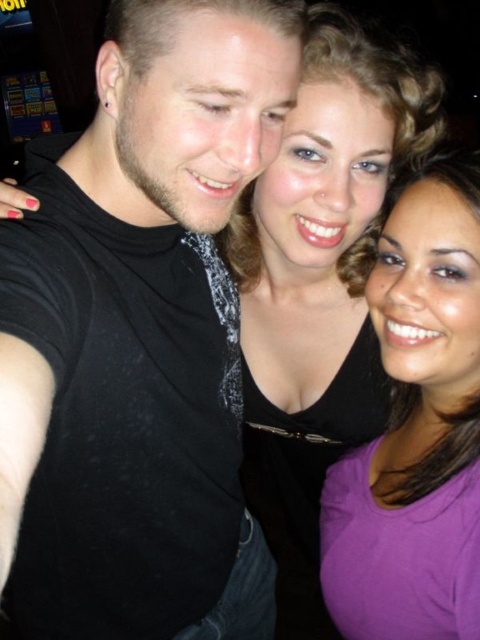
Is point (123, 458) closer to camera compared to point (332, 116)?

Yes, it is.

Between point (76, 472) and point (325, 211), which one is positioned in front?

Point (76, 472)

This screenshot has height=640, width=480. What do you see at coordinates (141, 339) in the screenshot?
I see `black matte shirt at left` at bounding box center [141, 339].

Where is `black matte shirt at left`? The image size is (480, 640). black matte shirt at left is located at coordinates (141, 339).

Consider the image. Does matte black top at center have a larger size compared to purple matte shirt at center?

Yes.

Image resolution: width=480 pixels, height=640 pixels. Describe the element at coordinates (320, 284) in the screenshot. I see `matte black top at center` at that location.

What do you see at coordinates (320, 284) in the screenshot? I see `matte black top at center` at bounding box center [320, 284].

Locate an element on the screen. Image resolution: width=480 pixels, height=640 pixels. matte black top at center is located at coordinates (320, 284).

Is black matte shirt at left wider than purple matte shirt at center?

Yes.

The width and height of the screenshot is (480, 640). I want to click on black matte shirt at left, so click(141, 339).

The height and width of the screenshot is (640, 480). Find the location of `black matte shirt at left`. black matte shirt at left is located at coordinates [x=141, y=339].